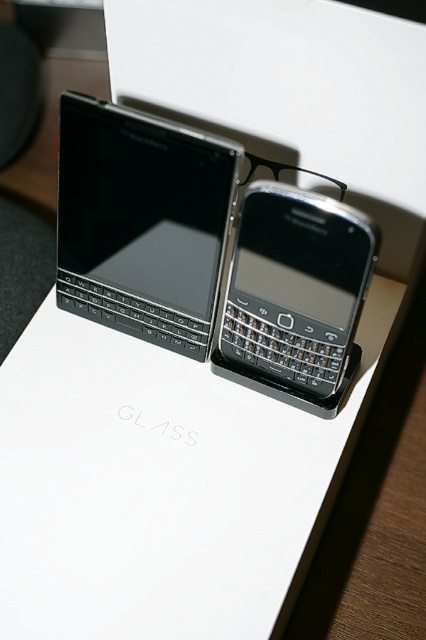
Can you confirm if matte black keyboard at upper left is positioned to the left of black matte smartphone at center?

Indeed, matte black keyboard at upper left is positioned on the left side of black matte smartphone at center.

Is matte black keyboard at upper left thinner than black matte smartphone at center?

Incorrect, matte black keyboard at upper left's width is not less than black matte smartphone at center's.

Between point (60, 200) and point (317, 292), which one is positioned behind?

The point (60, 200) is behind.

The height and width of the screenshot is (640, 426). I want to click on matte black keyboard at upper left, so click(x=141, y=221).